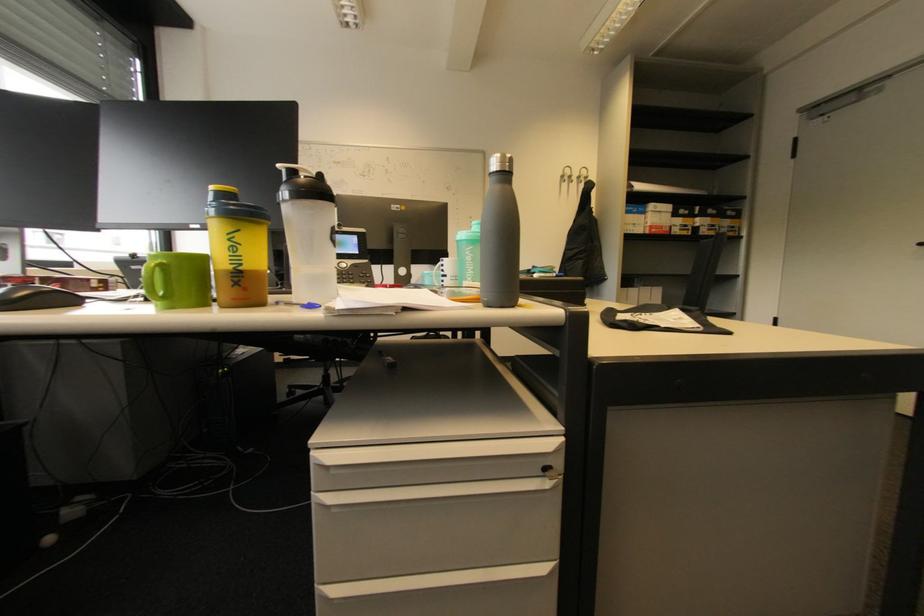
Image resolution: width=924 pixels, height=616 pixels. What are the coordinates of `yellow bottle cap` in the screenshot? It's located at (224, 195).